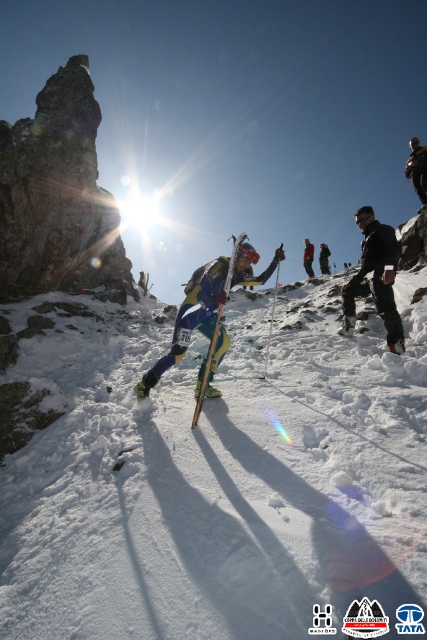
You are a drone operator trying to capture the best aerial shot of the skier. You have two points marked on your screen, point A at coordinates point (233, 614) and point B at coordinates point (210, 355). Which point should you prioritize to frame the skier in the foreground?

Point A at coordinates point (233, 614) should be prioritized because it is in front of point B, making it closer to the camera and ideal for framing the skier in the foreground.

You are a photographer trying to capture the skier in the image. You notice the yellow matte ski at center and the blue fabric jacket at center. Which object is wider when viewed from your camera angle?

The blue fabric jacket at center is wider than the yellow matte ski at center.

You are a photographer planning to capture a photo of the yellow matte ski at center and the white powdery snow at center. Based on the scene, which object is positioned lower in the image?

The white powdery snow at center is located below the yellow matte ski at center, so it is positioned lower in the image.